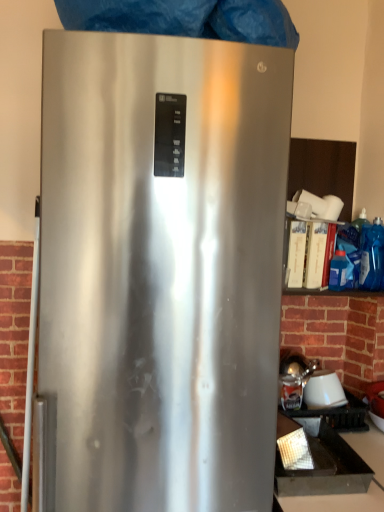
Question: Are white glossy lampshade at lower right and satin silver refrigerator at center far apart?

Choices:
 (A) no
 (B) yes

Answer: (A)

Question: Is white glossy lampshade at lower right looking in the opposite direction of satin silver refrigerator at center?

Choices:
 (A) no
 (B) yes

Answer: (A)

Question: Is white glossy lampshade at lower right at the left side of satin silver refrigerator at center?

Choices:
 (A) yes
 (B) no

Answer: (B)

Question: Does white glossy lampshade at lower right turn towards satin silver refrigerator at center?

Choices:
 (A) no
 (B) yes

Answer: (A)

Question: Is white glossy lampshade at lower right shorter than satin silver refrigerator at center?

Choices:
 (A) yes
 (B) no

Answer: (A)

Question: Is white glossy lampshade at lower right to the right of satin silver refrigerator at center from the viewer's perspective?

Choices:
 (A) yes
 (B) no

Answer: (A)

Question: Is white glossy lampshade at lower right at the right side of blue plastic bag at right?

Choices:
 (A) no
 (B) yes

Answer: (A)

Question: Is blue plastic bag at right inside white glossy lampshade at lower right?

Choices:
 (A) no
 (B) yes

Answer: (A)

Question: From the image's perspective, is white glossy lampshade at lower right located above blue plastic bag at right?

Choices:
 (A) no
 (B) yes

Answer: (A)

Question: Can you confirm if white glossy lampshade at lower right is shorter than blue plastic bag at right?

Choices:
 (A) yes
 (B) no

Answer: (A)

Question: Is white glossy lampshade at lower right taller than blue plastic bag at right?

Choices:
 (A) no
 (B) yes

Answer: (A)

Question: Is white glossy lampshade at lower right positioned with its back to blue plastic bag at right?

Choices:
 (A) no
 (B) yes

Answer: (A)

Question: Is brickwork at left a part of blue plastic bag at right?

Choices:
 (A) yes
 (B) no

Answer: (B)